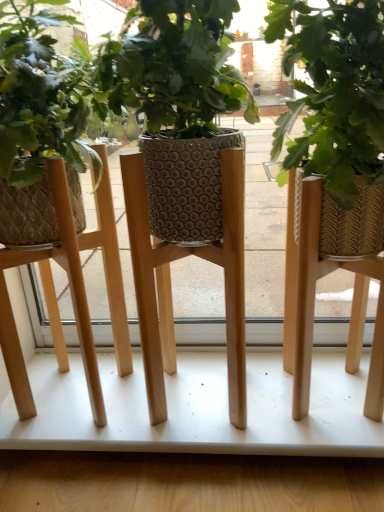
Question: Should I look upward or downward to see wooden stool at center?

Choices:
 (A) up
 (B) down

Answer: (A)

Question: Does woven straw planter at center lie behind wooden table at center?

Choices:
 (A) no
 (B) yes

Answer: (A)

Question: Is woven straw planter at center aimed at wooden table at center?

Choices:
 (A) yes
 (B) no

Answer: (B)

Question: Considering the relative sizes of woven straw planter at center and wooden table at center in the image provided, is woven straw planter at center taller than wooden table at center?

Choices:
 (A) yes
 (B) no

Answer: (A)

Question: From a real-world perspective, is woven straw planter at center positioned under wooden table at center based on gravity?

Choices:
 (A) no
 (B) yes

Answer: (A)

Question: From the image's perspective, does woven straw planter at center appear higher than wooden table at center?

Choices:
 (A) no
 (B) yes

Answer: (B)

Question: Are woven straw planter at center and wooden table at center beside each other?

Choices:
 (A) yes
 (B) no

Answer: (B)

Question: Considering the relative sizes of woven straw planter at center and wooden stool at center in the image provided, is woven straw planter at center wider than wooden stool at center?

Choices:
 (A) no
 (B) yes

Answer: (A)

Question: From a real-world perspective, is woven straw planter at center on top of wooden stool at center?

Choices:
 (A) no
 (B) yes

Answer: (A)

Question: Is woven straw planter at center positioned in front of wooden stool at center?

Choices:
 (A) no
 (B) yes

Answer: (B)

Question: Is woven straw planter at center not near wooden stool at center?

Choices:
 (A) yes
 (B) no

Answer: (B)

Question: Can you confirm if woven straw planter at center is smaller than wooden stool at center?

Choices:
 (A) yes
 (B) no

Answer: (B)

Question: Is woven straw planter at center facing towards wooden stool at center?

Choices:
 (A) no
 (B) yes

Answer: (A)

Question: From the image's perspective, is wooden table at center under woven straw planter at center?

Choices:
 (A) yes
 (B) no

Answer: (A)